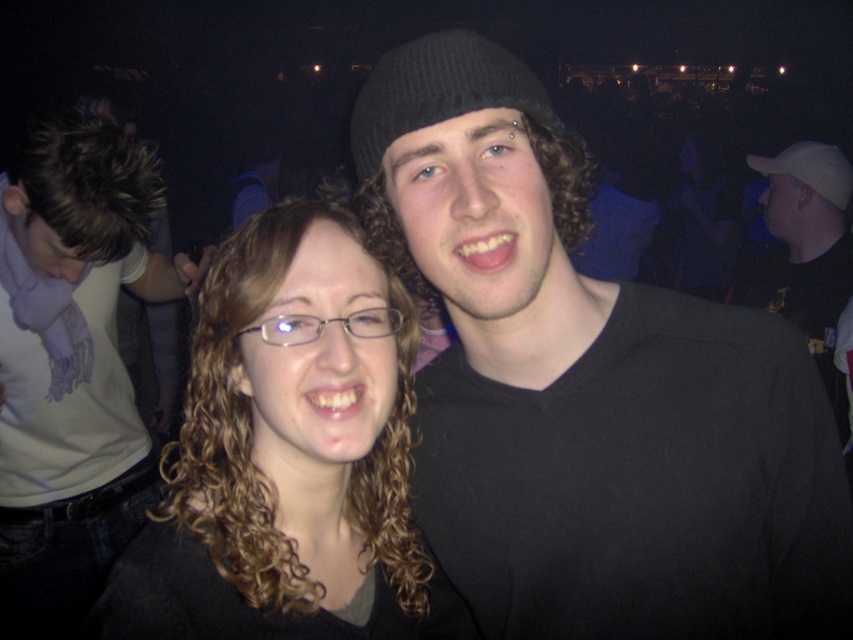
You are standing in the center of the image and want to move toward the black matte shirt at center. Which direction should you move in to reach it?

The black matte shirt at center is located at the coordinates point [589,388], so you should move towards the direction of those coordinates to reach it.